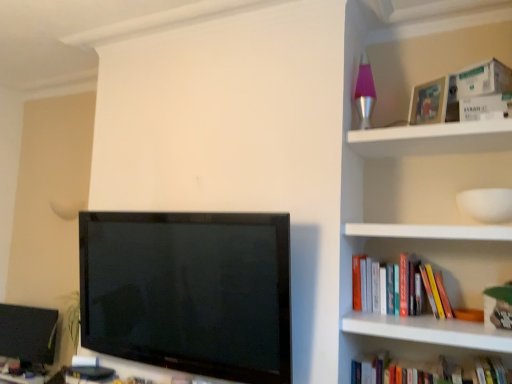
Question: Does point (479, 99) appear closer or farther from the camera than point (438, 279)?

Choices:
 (A) closer
 (B) farther

Answer: (A)

Question: Considering the relative positions of white cardboard box at upper right, the first paperback book positioned from the bottom, and hardcover book at right, which is counted as the 1th book, starting from the top, in the image provided, is white cardboard box at upper right, the first paperback book positioned from the bottom, to the left or to the right of hardcover book at right, which is counted as the 1th book, starting from the top,?

Choices:
 (A) left
 (B) right

Answer: (B)

Question: Estimate the real-world distances between objects in this image. Which object is closer to the hardcover book at right, which is counted as the 1th book, starting from the top?

Choices:
 (A) hardcover book at lower right, which is counted as the first book, starting from the bottom
 (B) white cardboard box at upper right, marked as the first paperback book in a top-to-bottom arrangement
 (C) white cardboard box at upper right, the 2th paperback book positioned from the top
 (D) matte black monitor at lower left

Answer: (A)

Question: Based on their relative distances, which object is nearer to the hardcover book at right, which is counted as the 1th book, starting from the top?

Choices:
 (A) matte black monitor at lower left
 (B) hardcover book at lower right, the 2th book viewed from the top
 (C) white cardboard box at upper right, which is counted as the second paperback book, starting from the bottom
 (D) white cardboard box at upper right, the first paperback book positioned from the bottom

Answer: (B)